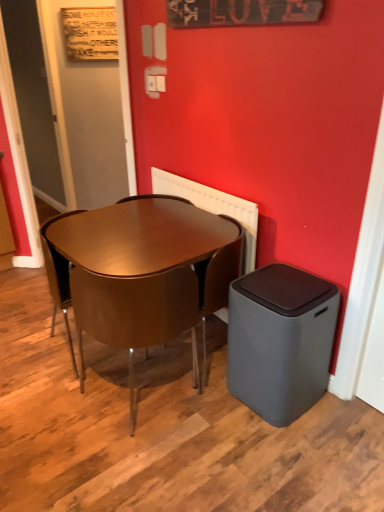
Locate an element on the screen. This screenshot has width=384, height=512. free spot in front of matte brown table at center is located at coordinates (158, 450).